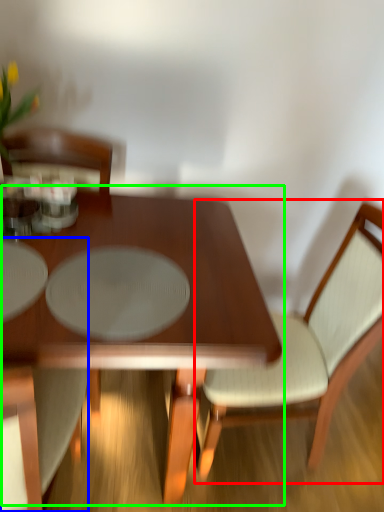
Question: Considering the real-world distances, which object is farthest from chair (highlighted by a red box)? chair (highlighted by a blue box) or coffee table (highlighted by a green box)?

Choices:
 (A) chair
 (B) coffee table

Answer: (A)